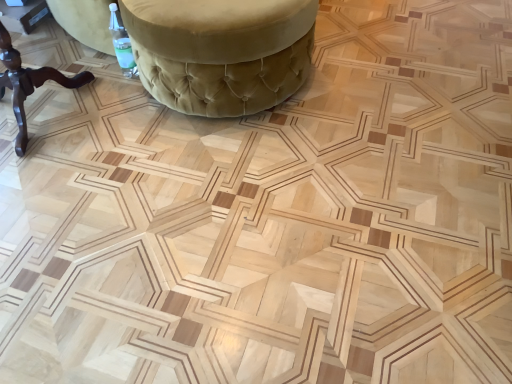
Question: Which direction should I rotate to look at velvet green ottoman at upper center, marked as the second furniture in a left-to-right arrangement?

Choices:
 (A) right
 (B) left

Answer: (B)

Question: Is the position of velvet green ottoman at upper center, acting as the 1th furniture starting from the right, less distant than that of brown wooden table at left, the 2th furniture viewed from the right?

Choices:
 (A) no
 (B) yes

Answer: (A)

Question: Can you confirm if velvet green ottoman at upper center, acting as the 1th furniture starting from the right, is smaller than brown wooden table at left, the 2th furniture viewed from the right?

Choices:
 (A) no
 (B) yes

Answer: (A)

Question: Considering the relative sizes of velvet green ottoman at upper center, acting as the 1th furniture starting from the right, and brown wooden table at left, the 2th furniture viewed from the right, in the image provided, is velvet green ottoman at upper center, acting as the 1th furniture starting from the right, thinner than brown wooden table at left, the 2th furniture viewed from the right,?

Choices:
 (A) no
 (B) yes

Answer: (A)

Question: Considering the relative positions of velvet green ottoman at upper center, acting as the 1th furniture starting from the right, and brown wooden table at left, the 1th furniture in the left-to-right sequence, in the image provided, is velvet green ottoman at upper center, acting as the 1th furniture starting from the right, behind brown wooden table at left, the 1th furniture in the left-to-right sequence,?

Choices:
 (A) no
 (B) yes

Answer: (B)

Question: From a real-world perspective, is velvet green ottoman at upper center, marked as the second furniture in a left-to-right arrangement, on top of brown wooden table at left, the 2th furniture viewed from the right?

Choices:
 (A) yes
 (B) no

Answer: (B)

Question: Can you see velvet green ottoman at upper center, acting as the 1th furniture starting from the right, touching brown wooden table at left, the 1th furniture in the left-to-right sequence?

Choices:
 (A) yes
 (B) no

Answer: (B)

Question: Is brown wooden table at left, the 2th furniture viewed from the right, to the left of velvet green ottoman at upper center, marked as the second furniture in a left-to-right arrangement, from the viewer's perspective?

Choices:
 (A) yes
 (B) no

Answer: (A)

Question: Is brown wooden table at left, the 2th furniture viewed from the right, with velvet green ottoman at upper center, acting as the 1th furniture starting from the right?

Choices:
 (A) no
 (B) yes

Answer: (A)

Question: From the image's perspective, is brown wooden table at left, the 1th furniture in the left-to-right sequence, under velvet green ottoman at upper center, acting as the 1th furniture starting from the right?

Choices:
 (A) no
 (B) yes

Answer: (B)

Question: Is brown wooden table at left, the 1th furniture in the left-to-right sequence, taller than velvet green ottoman at upper center, marked as the second furniture in a left-to-right arrangement?

Choices:
 (A) no
 (B) yes

Answer: (B)

Question: From a real-world perspective, is brown wooden table at left, the 1th furniture in the left-to-right sequence, located beneath velvet green ottoman at upper center, acting as the 1th furniture starting from the right?

Choices:
 (A) no
 (B) yes

Answer: (A)

Question: Is brown wooden table at left, the 2th furniture viewed from the right, aimed at velvet green ottoman at upper center, acting as the 1th furniture starting from the right?

Choices:
 (A) yes
 (B) no

Answer: (B)

Question: In terms of size, does velvet green ottoman at upper center, marked as the second furniture in a left-to-right arrangement, appear bigger or smaller than brown wooden table at left, the 2th furniture viewed from the right?

Choices:
 (A) big
 (B) small

Answer: (A)